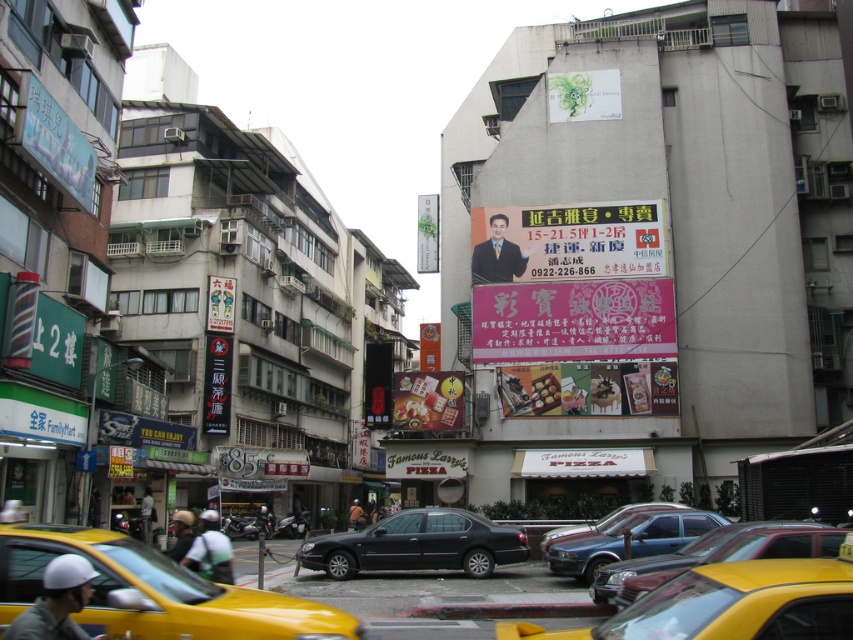
Who is more forward, (515, 225) or (421, 230)?

Point (515, 225) is more forward.

Based on the photo, which is above, matte black signboard at center or green matte sign at center?

green matte sign at center

Describe the element at coordinates (567, 241) in the screenshot. I see `matte black signboard at center` at that location.

Find the location of a particular element. This screenshot has width=853, height=640. matte black signboard at center is located at coordinates (567, 241).

Is black matte signboard at center-left behind white cardboard sign at center?

That is False.

Can you confirm if black matte signboard at center-left is wider than white cardboard sign at center?

Yes.

The width and height of the screenshot is (853, 640). I want to click on black matte signboard at center-left, so click(x=218, y=384).

Image resolution: width=853 pixels, height=640 pixels. In order to click on black matte signboard at center-left in this screenshot , I will do `click(218, 384)`.

Can you confirm if pink matte billboard at center is thinner than white cardboard sign at center?

No.

Is pink matte billboard at center above white cardboard sign at center?

No, pink matte billboard at center is not above white cardboard sign at center.

Locate an element on the screen. The image size is (853, 640). pink matte billboard at center is located at coordinates (x=573, y=321).